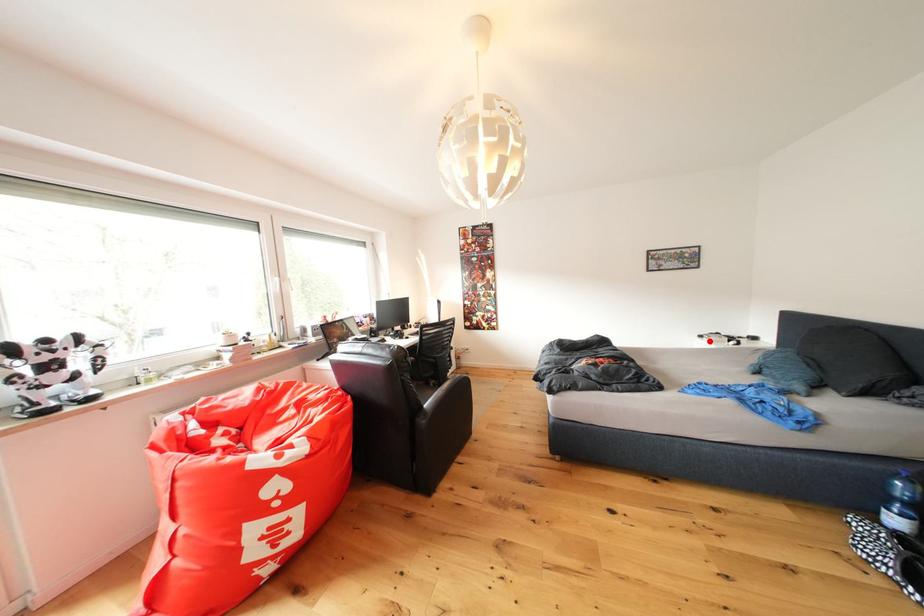
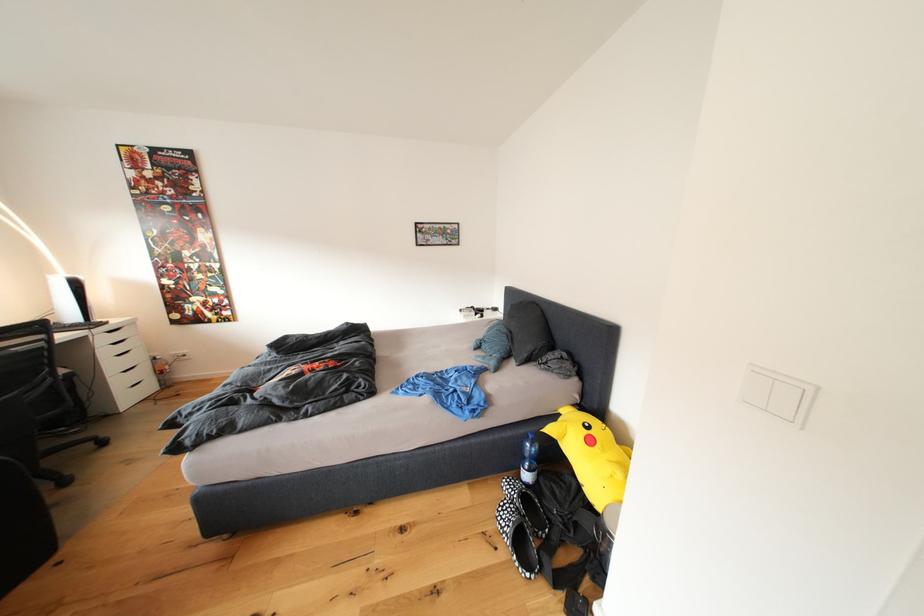
Find the pixel in the second image that matches the highlighted location in the first image.

(469, 315)